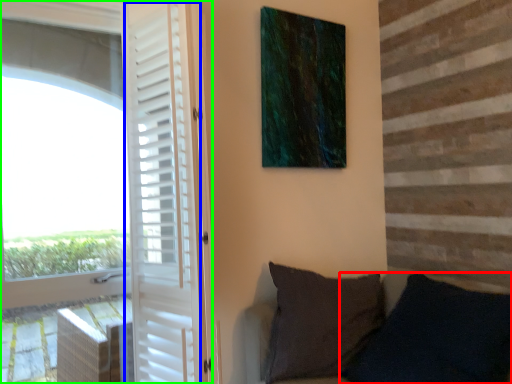
Question: Estimate the real-world distances between objects in this image. Which object is farther from pillow (highlighted by a red box), screen door (highlighted by a blue box) or door (highlighted by a green box)?

Choices:
 (A) screen door
 (B) door

Answer: (B)